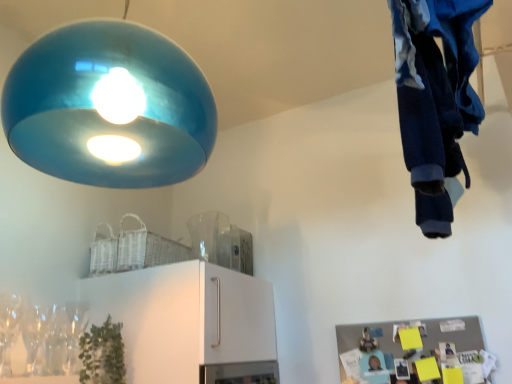
Question: From a real-world perspective, is green matte plant at lower left positioned under clear glass wine glass at lower left based on gravity?

Choices:
 (A) yes
 (B) no

Answer: (A)

Question: Is green matte plant at lower left taller than clear glass wine glass at lower left?

Choices:
 (A) no
 (B) yes

Answer: (A)

Question: From the image's perspective, is green matte plant at lower left below clear glass wine glass at lower left?

Choices:
 (A) no
 (B) yes

Answer: (B)

Question: Is green matte plant at lower left bigger than clear glass wine glass at lower left?

Choices:
 (A) no
 (B) yes

Answer: (B)

Question: Are green matte plant at lower left and clear glass wine glass at lower left beside each other?

Choices:
 (A) yes
 (B) no

Answer: (B)

Question: In the image, is blue cotton pants at upper right positioned in front of or behind clear glass wine glass at lower left?

Choices:
 (A) front
 (B) behind

Answer: (A)

Question: From a real-world perspective, relative to clear glass wine glass at lower left, is blue cotton pants at upper right vertically above or below?

Choices:
 (A) above
 (B) below

Answer: (A)

Question: Is blue cotton pants at upper right bigger or smaller than clear glass wine glass at lower left?

Choices:
 (A) big
 (B) small

Answer: (A)

Question: From the image's perspective, is blue cotton pants at upper right above or below clear glass wine glass at lower left?

Choices:
 (A) below
 (B) above

Answer: (B)

Question: In terms of height, does clear glass wine glass at lower left look taller or shorter compared to green matte plant at lower left?

Choices:
 (A) tall
 (B) short

Answer: (A)

Question: From the image's perspective, is clear glass wine glass at lower left above or below green matte plant at lower left?

Choices:
 (A) above
 (B) below

Answer: (A)

Question: Considering the relative positions of clear glass wine glass at lower left and green matte plant at lower left in the image provided, is clear glass wine glass at lower left to the left or to the right of green matte plant at lower left?

Choices:
 (A) left
 (B) right

Answer: (A)

Question: From a real-world perspective, is clear glass wine glass at lower left positioned above or below green matte plant at lower left?

Choices:
 (A) below
 (B) above

Answer: (B)

Question: From a real-world perspective, is glossy blue lampshade at upper left physically located above or below clear glass wine glass at lower left?

Choices:
 (A) above
 (B) below

Answer: (A)

Question: Is glossy blue lampshade at upper left spatially inside clear glass wine glass at lower left, or outside of it?

Choices:
 (A) inside
 (B) outside

Answer: (B)